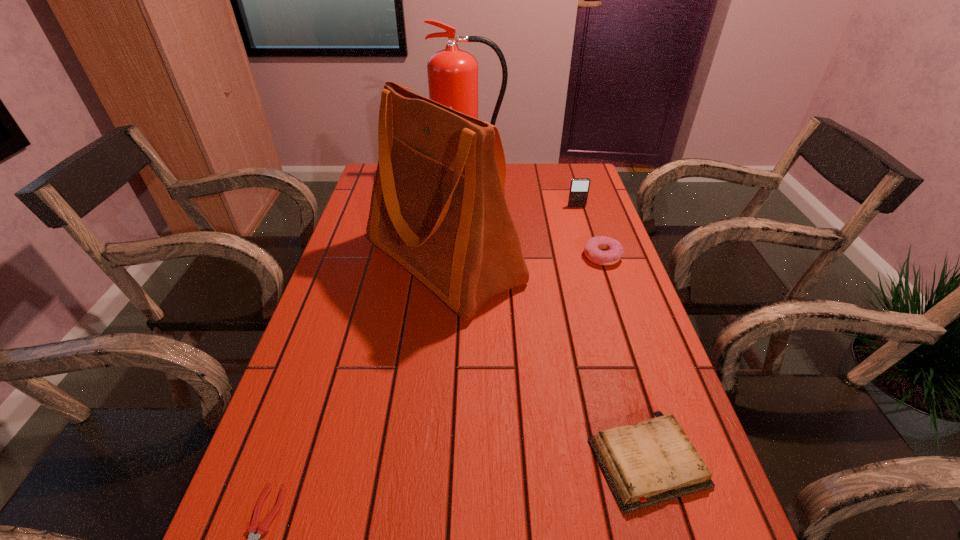
Find the location of `empty space between the diary and the shopping bag`. empty space between the diary and the shopping bag is located at coordinates (545, 361).

Locate an element on the screen. This screenshot has width=960, height=540. vacant region between the fire extinguisher and the diary is located at coordinates (559, 318).

The width and height of the screenshot is (960, 540). Identify the location of unoccupied area between the doughnut and the fifth tallest object. pos(625,359).

In order to click on object that is the third closest to the farthest object in this screenshot , I will do `click(613, 250)`.

Select which object is the closest to the third shortest object. Please provide its 2D coordinates. Your answer should be formatted as a tuple, i.e. [(x, y)], where the tuple contains the x and y coordinates of a point satisfying the conditions above.

[(438, 208)]

This screenshot has width=960, height=540. I want to click on free space that satisfies the following two spatial constraints: 1. towards the nozzle of the farthest object; 2. on the right side of the fourth tallest object, so click(467, 256).

Locate an element on the screen. free spot that satisfies the following two spatial constraints: 1. on the front side of the diary; 2. on the left side of the shopping bag is located at coordinates (423, 461).